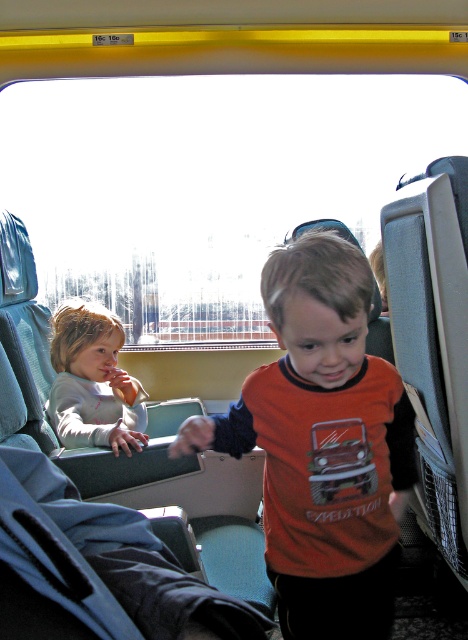
Question: Is orange matte shirt at center above blue fabric coach at lower left?

Choices:
 (A) yes
 (B) no

Answer: (A)

Question: Is orange matte shirt at center thinner than light gray fleece shirt at left?

Choices:
 (A) yes
 (B) no

Answer: (B)

Question: Can you confirm if orange matte shirt at center is smaller than blue fabric coach at lower left?

Choices:
 (A) no
 (B) yes

Answer: (A)

Question: Which object appears closest to the camera in this image?

Choices:
 (A) orange matte shirt at center
 (B) light gray fleece shirt at left
 (C) blue fabric coach at lower left

Answer: (C)

Question: Which of the following is the farthest from the observer?

Choices:
 (A) (90, 344)
 (B) (7, 497)
 (C) (372, 406)

Answer: (A)

Question: Which point is closer to the camera?

Choices:
 (A) blue fabric coach at lower left
 (B) light gray fleece shirt at left
 (C) orange matte shirt at center

Answer: (A)